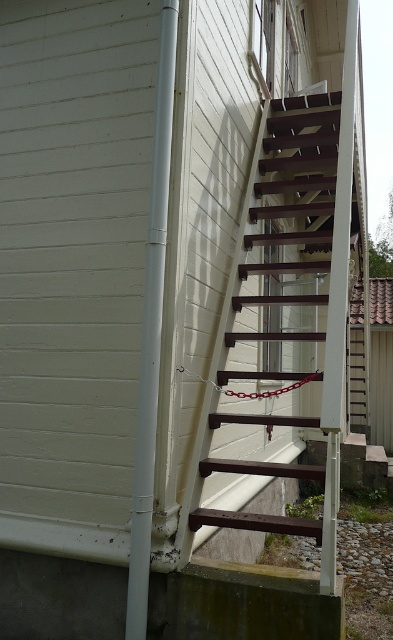
You are standing in front of the building and looking at the staircase. Which of the two points, point (334,227) or point (165,150), is closer to you?

Point (334,227) is closer to you because it is further to the viewer than point (165,150).

You are standing at the base of the building and want to reach the balcony using the brown wooden ladder at center and the white plastic pole at left. Which object should you move closer to first to access the balcony?

The brown wooden ladder at center is positioned on the right side of the white plastic pole at left, so you should move closer to the white plastic pole at left first to access the balcony.

You are a painter needing to reach a high point on the building. You have a brown wooden ladder at center and a white plastic pole at left. Which tool should you choose if you need the taller one?

The white plastic pole at left is taller than the brown wooden ladder at center, so you should choose the white plastic pole at left.